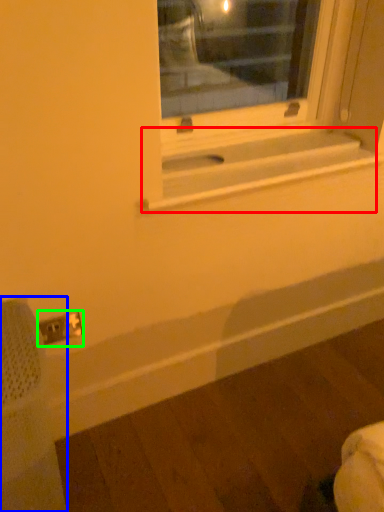
Question: Which object is the closest to the window sill (highlighted by a red box)? Choose among these: swivel chair (highlighted by a blue box) or electric outlet (highlighted by a green box).

Choices:
 (A) swivel chair
 (B) electric outlet

Answer: (B)